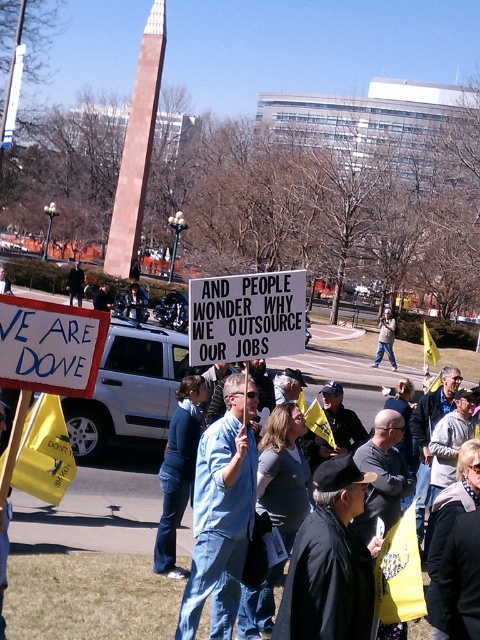
Who is positioned more to the left, blue denim shirt at center or white cardboard sign at center?

From the viewer's perspective, white cardboard sign at center appears more on the left side.

The image size is (480, 640). Identify the location of blue denim shirt at center. (222, 513).

Where is `blue denim shirt at center`? The image size is (480, 640). blue denim shirt at center is located at coordinates (222, 513).

Can you confirm if blue denim shirt at center is positioned to the left of white paper sign at center?

Yes, blue denim shirt at center is to the left of white paper sign at center.

Is point (223, 618) positioned in front of point (297, 300)?

That is True.

Describe the element at coordinates (222, 513) in the screenshot. Image resolution: width=480 pixels, height=640 pixels. I see `blue denim shirt at center` at that location.

The height and width of the screenshot is (640, 480). I want to click on blue denim shirt at center, so pos(222,513).

Who is positioned more to the right, white cardboard sign at center or denim jacket at center?

denim jacket at center

Who is lower down, white cardboard sign at center or denim jacket at center?

denim jacket at center is below.

Which is in front, point (4, 307) or point (274, 577)?

Point (4, 307) is in front.

This screenshot has width=480, height=640. Identify the location of white cardboard sign at center. (49, 346).